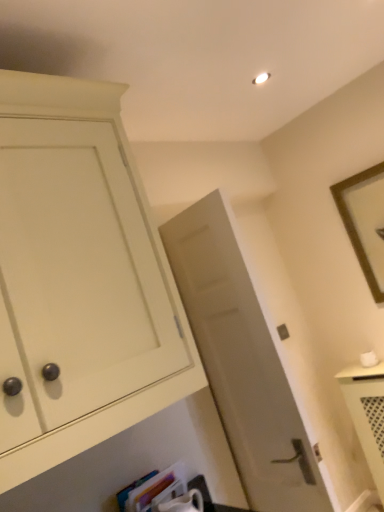
The width and height of the screenshot is (384, 512). I want to click on vacant space situated above hardcover book at lower center (from a real-world perspective), so click(x=128, y=468).